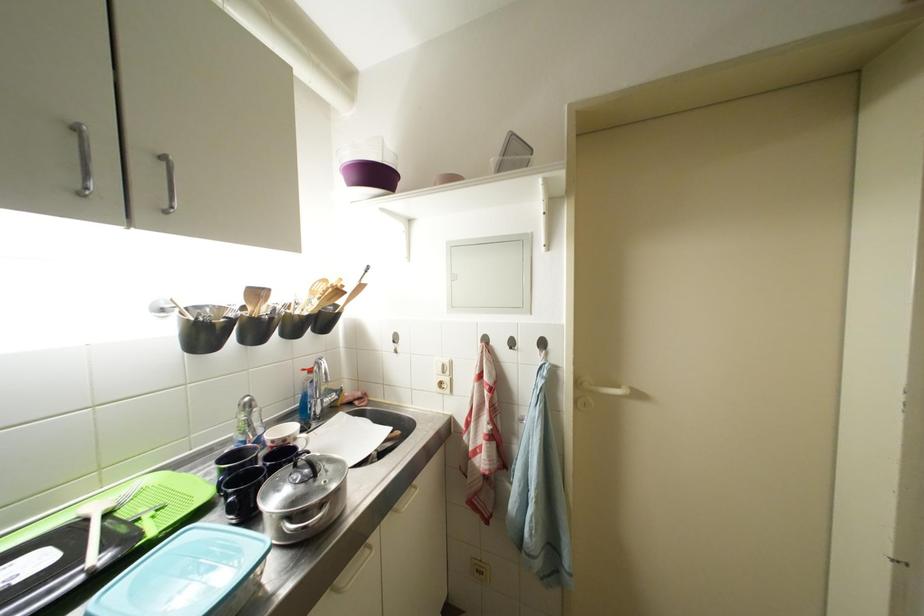
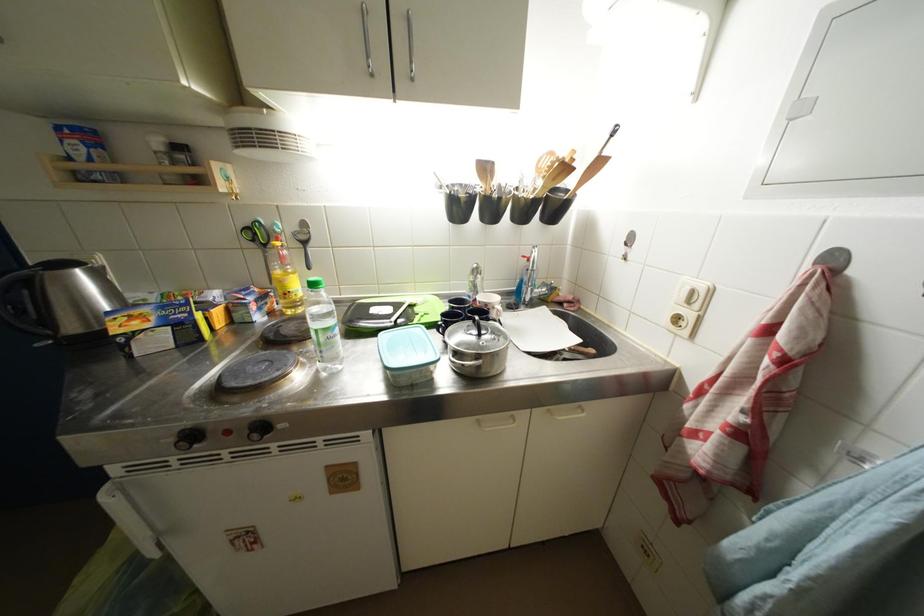
Where in the second image is the point corresponding to (450,376) from the first image?

(696, 306)